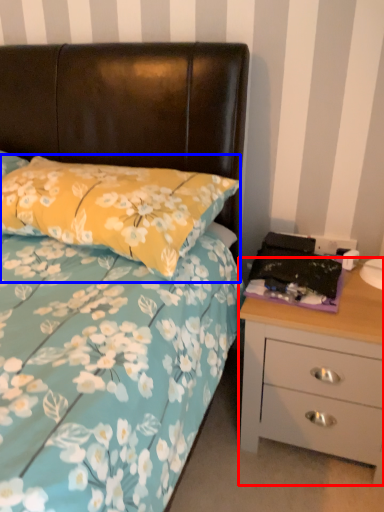
Question: Which of the following is the closest to the observer, chest of drawers (highlighted by a red box) or pillow (highlighted by a blue box)?

Choices:
 (A) chest of drawers
 (B) pillow

Answer: (B)